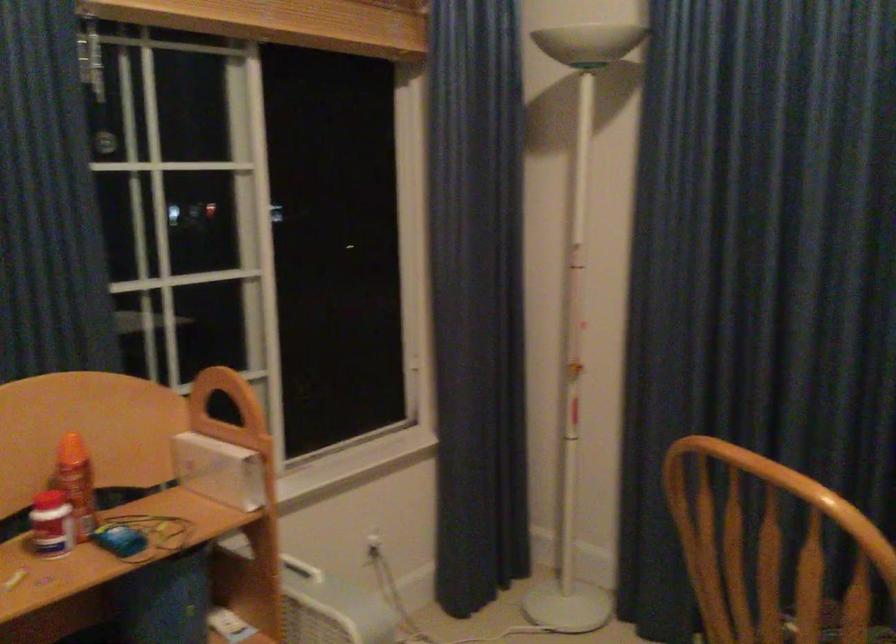
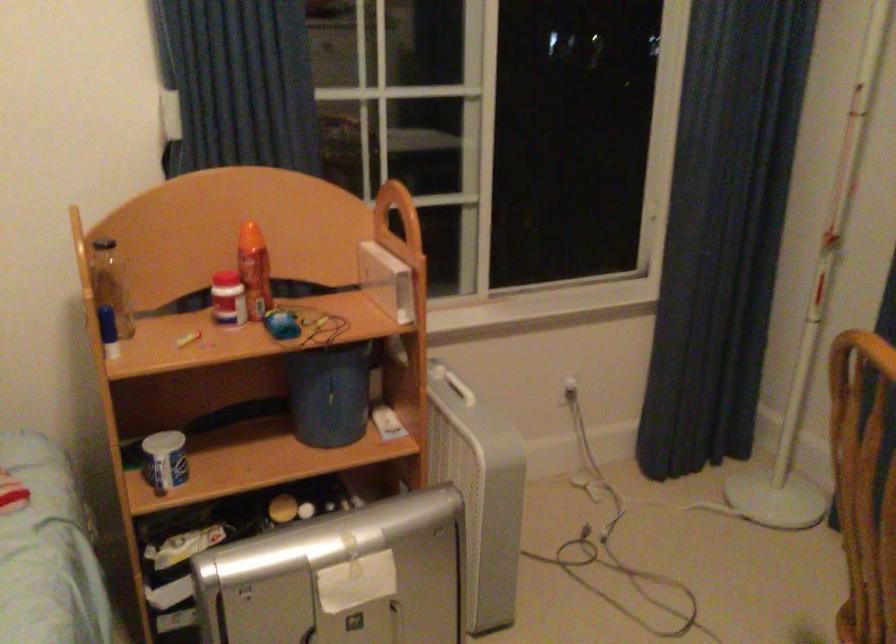
In the second image, find the point that corresponds to the point at 130,532 in the first image.

(281, 324)